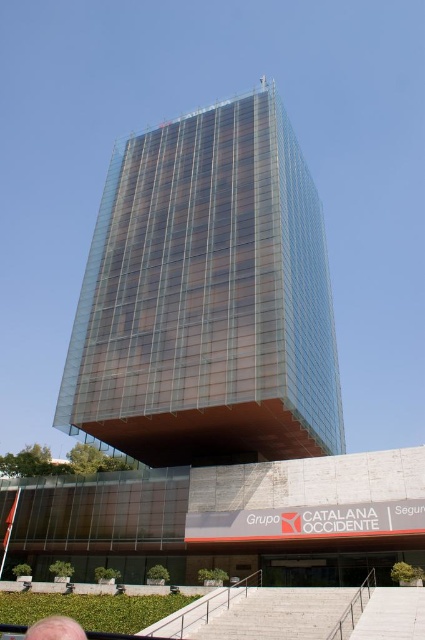
Question: Which object appears closest to the camera in this image?

Choices:
 (A) transparent glass tower at center
 (B) blonde hair at lower left

Answer: (B)

Question: Can you confirm if transparent glass tower at center is bigger than blonde hair at lower left?

Choices:
 (A) yes
 (B) no

Answer: (A)

Question: From the image, what is the correct spatial relationship of transparent glass tower at center in relation to blonde hair at lower left?

Choices:
 (A) above
 (B) below

Answer: (A)

Question: Is transparent glass tower at center to the left of blonde hair at lower left from the viewer's perspective?

Choices:
 (A) yes
 (B) no

Answer: (B)